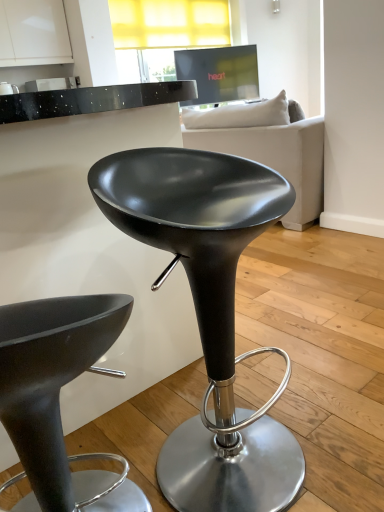
Question: Should I look upward or downward to see matte black stool at center, which appears as the 2th stool when viewed from the right?

Choices:
 (A) down
 (B) up

Answer: (A)

Question: Is matte black stool at center, the 1th stool positioned from the right, shorter than white fabric couch at upper center?

Choices:
 (A) no
 (B) yes

Answer: (B)

Question: Can you confirm if matte black stool at center, the 1th stool positioned from the right, is positioned to the right of white fabric couch at upper center?

Choices:
 (A) yes
 (B) no

Answer: (B)

Question: Is matte black stool at center, acting as the 2th stool starting from the left, completely or partially outside of white fabric couch at upper center?

Choices:
 (A) no
 (B) yes

Answer: (B)

Question: Is matte black stool at center, the 1th stool positioned from the right, facing towards white fabric couch at upper center?

Choices:
 (A) no
 (B) yes

Answer: (A)

Question: From the image's perspective, is matte black stool at center, acting as the 2th stool starting from the left, beneath white fabric couch at upper center?

Choices:
 (A) yes
 (B) no

Answer: (A)

Question: Is matte black stool at center, the 1th stool positioned from the right, to the left of white fabric couch at upper center from the viewer's perspective?

Choices:
 (A) no
 (B) yes

Answer: (B)

Question: Can you confirm if white fabric couch at upper center is positioned to the right of matte black stool at center, which appears as the 2th stool when viewed from the right?

Choices:
 (A) no
 (B) yes

Answer: (B)

Question: Is the position of white fabric couch at upper center more distant than that of matte black stool at center, which appears as the 2th stool when viewed from the right?

Choices:
 (A) no
 (B) yes

Answer: (B)

Question: Can we say white fabric couch at upper center lies outside matte black stool at center, the 1th stool positioned from the left?

Choices:
 (A) no
 (B) yes

Answer: (B)

Question: From the image's perspective, is white fabric couch at upper center located beneath matte black stool at center, the 1th stool positioned from the left?

Choices:
 (A) yes
 (B) no

Answer: (B)

Question: Does white fabric couch at upper center have a lesser height compared to matte black stool at center, the 1th stool positioned from the left?

Choices:
 (A) no
 (B) yes

Answer: (A)

Question: Does white fabric couch at upper center turn towards matte black stool at center, which appears as the 2th stool when viewed from the right?

Choices:
 (A) yes
 (B) no

Answer: (B)

Question: Is matte black stool at center, which appears as the 2th stool when viewed from the right, at the right side of white fabric couch at upper center?

Choices:
 (A) no
 (B) yes

Answer: (A)